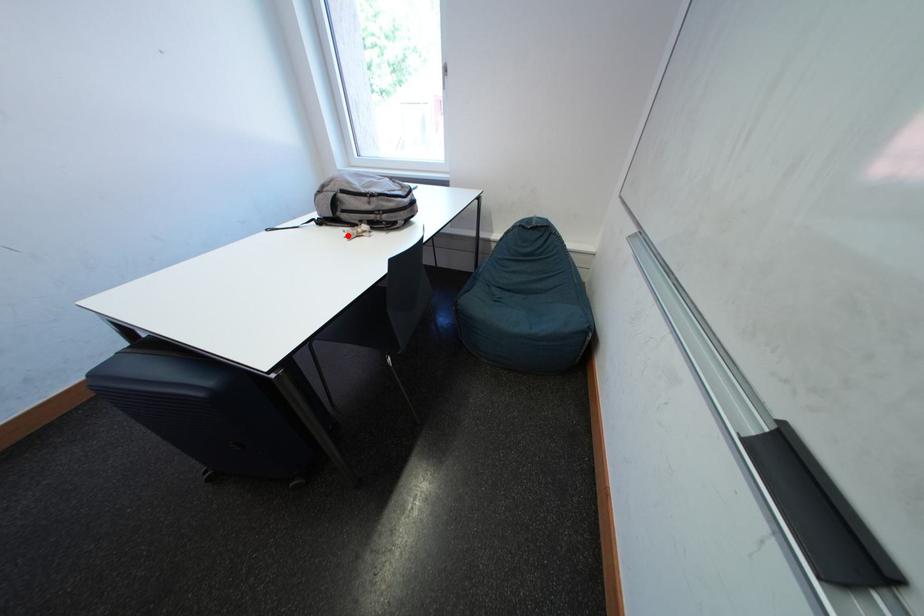
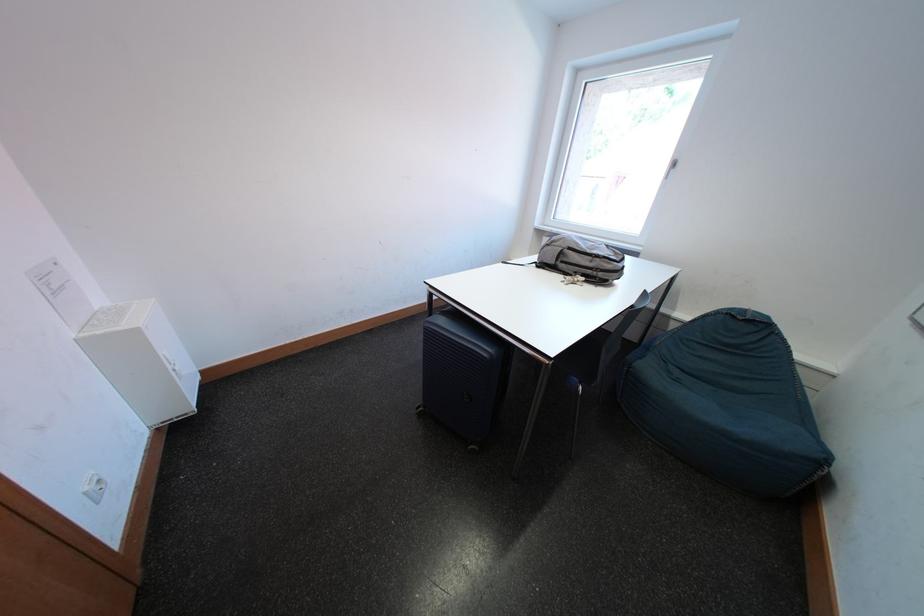
Locate, in the second image, the point that corresponds to the highlighted location in the first image.

(569, 280)